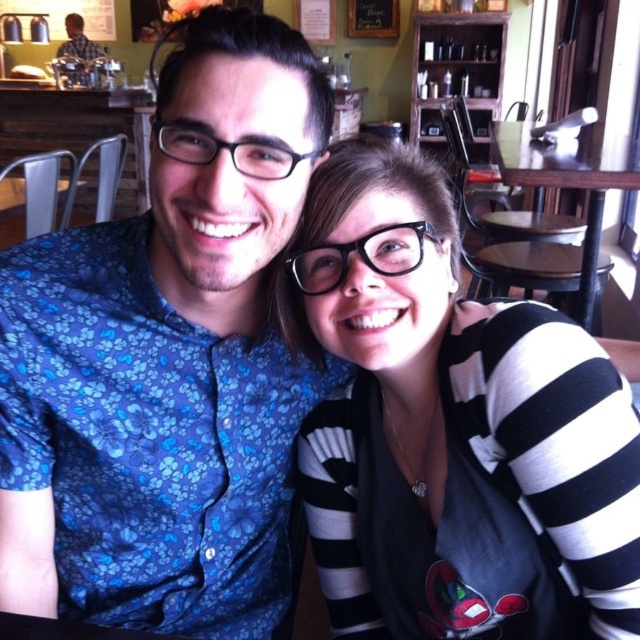
Question: Which object is the farthest from the wooden table at right?

Choices:
 (A) brushed metal water at bottle left
 (B) black and white striped sweater at center

Answer: (A)

Question: Among these points, which one is farthest from the camera?

Choices:
 (A) (580, 280)
 (B) (61, 52)
 (C) (483, 413)

Answer: (B)

Question: Is black and white striped sweater at center below wooden table at right?

Choices:
 (A) yes
 (B) no

Answer: (A)

Question: Which object appears farthest from the camera in this image?

Choices:
 (A) wooden table at right
 (B) black and white striped sweater at center

Answer: (A)

Question: Is black and white striped sweater at center closer to camera compared to wooden table at right?

Choices:
 (A) yes
 (B) no

Answer: (A)

Question: Does wooden table at right appear under brushed metal water at bottle left?

Choices:
 (A) yes
 (B) no

Answer: (A)